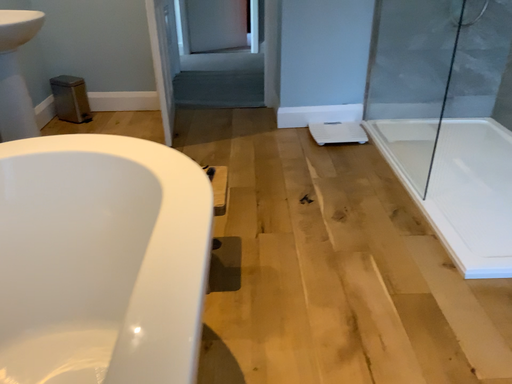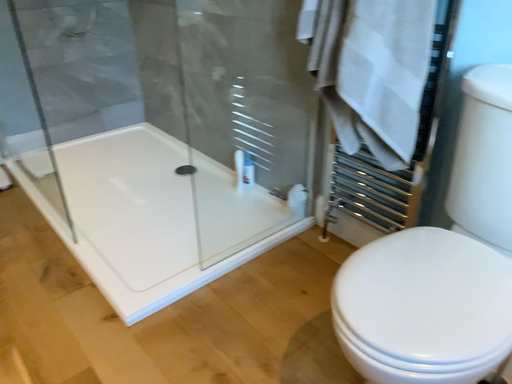
Question: Which way did the camera rotate in the video?

Choices:
 (A) rotated upward
 (B) rotated downward

Answer: (A)